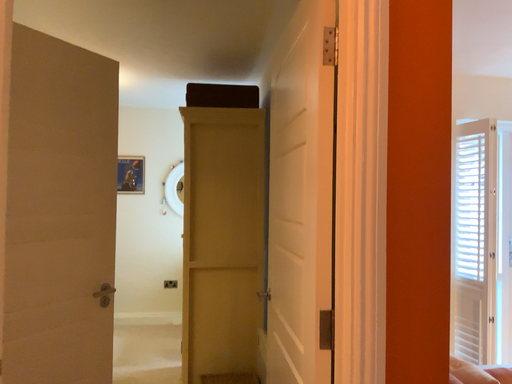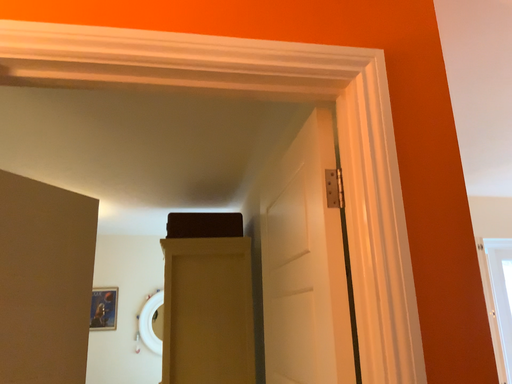
Question: How did the camera likely rotate when shooting the video?

Choices:
 (A) rotated upward
 (B) rotated downward

Answer: (A)